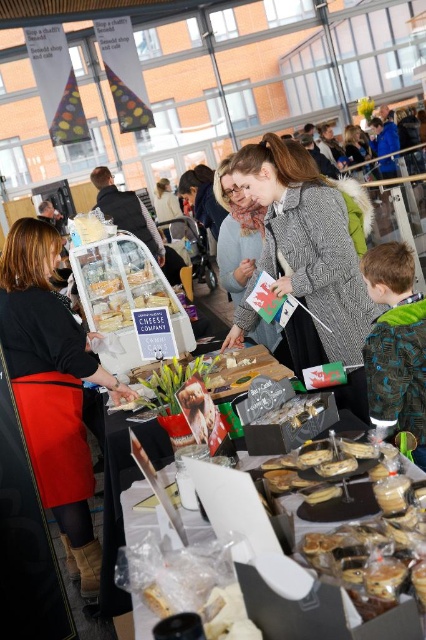
Question: Observing the image, what is the correct spatial positioning of matte black apron at left in reference to golden brown pastry at center?

Choices:
 (A) below
 (B) above

Answer: (B)

Question: Is translucent plastic cheese at center thinner than golden brown pastry at center?

Choices:
 (A) no
 (B) yes

Answer: (A)

Question: Considering the relative positions of matte black apron at left and golden brown pastry at center in the image provided, where is matte black apron at left located with respect to golden brown pastry at center?

Choices:
 (A) left
 (B) right

Answer: (A)

Question: Which point is farther from the camera taking this photo?

Choices:
 (A) [74, 472]
 (B) [121, 502]
 (C) [259, 218]
 (D) [317, 500]

Answer: (C)

Question: Which point is farther to the camera?

Choices:
 (A) (57, 321)
 (B) (146, 516)

Answer: (A)

Question: Which of the following is the farthest from the observer?

Choices:
 (A) gray herringbone coat at center
 (B) translucent plastic cheese at center
 (C) matte black apron at left

Answer: (B)